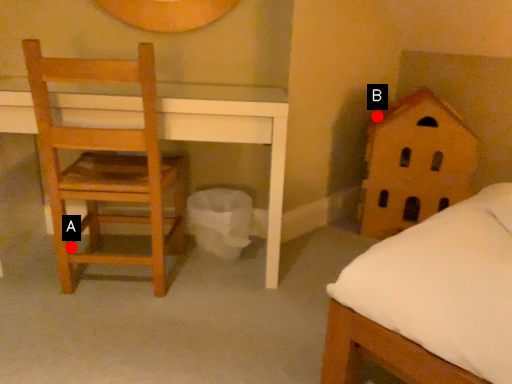
Question: Two points are circled on the image, labeled by A and B beside each circle. Which point is farther from the camera taking this photo?

Choices:
 (A) A is further
 (B) B is further

Answer: (B)